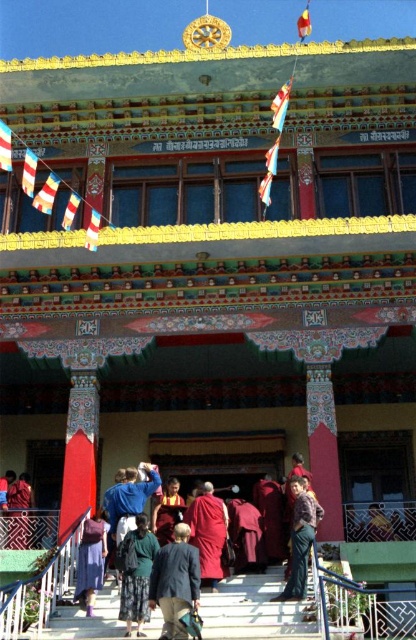
Question: Is red velvet robe at lower left smaller than white fabric flag at upper center?

Choices:
 (A) no
 (B) yes

Answer: (B)

Question: Which point is closer to the camera?

Choices:
 (A) red fabric flag at upper center
 (B) striped fabric flag at left
 (C) denim pants at lower center
 (D) white fabric flag at upper center

Answer: (C)

Question: Estimate the real-world distances between objects in this image. Which object is farther from the maroon woolen robe at center?

Choices:
 (A) yellow fabric flag at center
 (B) white fabric flag at left

Answer: (B)

Question: Which of the following is the closest to the observer?

Choices:
 (A) white fabric flag at upper center
 (B) red fabric flag at upper center

Answer: (A)

Question: From the image, what is the correct spatial relationship of striped fabric flag at left in relation to white fabric flag at left?

Choices:
 (A) above
 (B) below

Answer: (B)

Question: Can you confirm if dark blue fabric jacket at lower center is positioned to the right of white fabric flag at upper center?

Choices:
 (A) yes
 (B) no

Answer: (B)